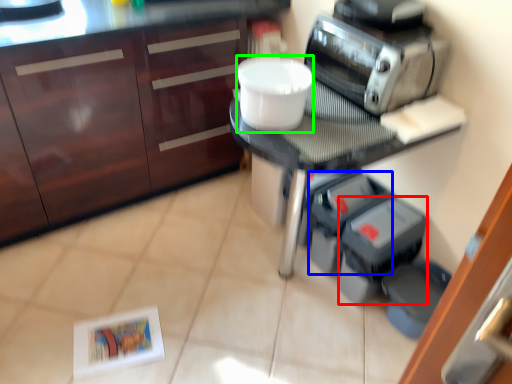
Question: Which is nearer to the appliance (highlighted by a red box)? appliance (highlighted by a blue box) or toilet bowl (highlighted by a green box).

Choices:
 (A) appliance
 (B) toilet bowl

Answer: (A)